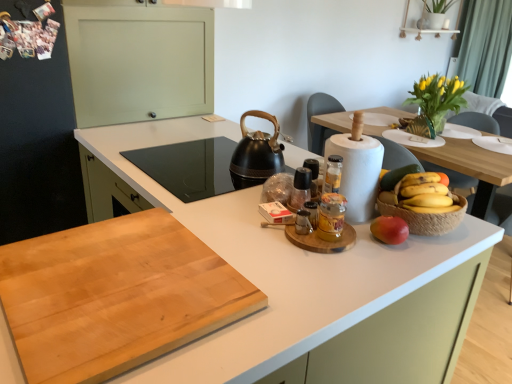
At what (x,y) coordinates should I click in order to perform the action: click on free space in front of red matte apple at right. Please return your answer as a coordinate pair (x, y). This screenshot has width=512, height=384. Looking at the image, I should click on (384, 264).